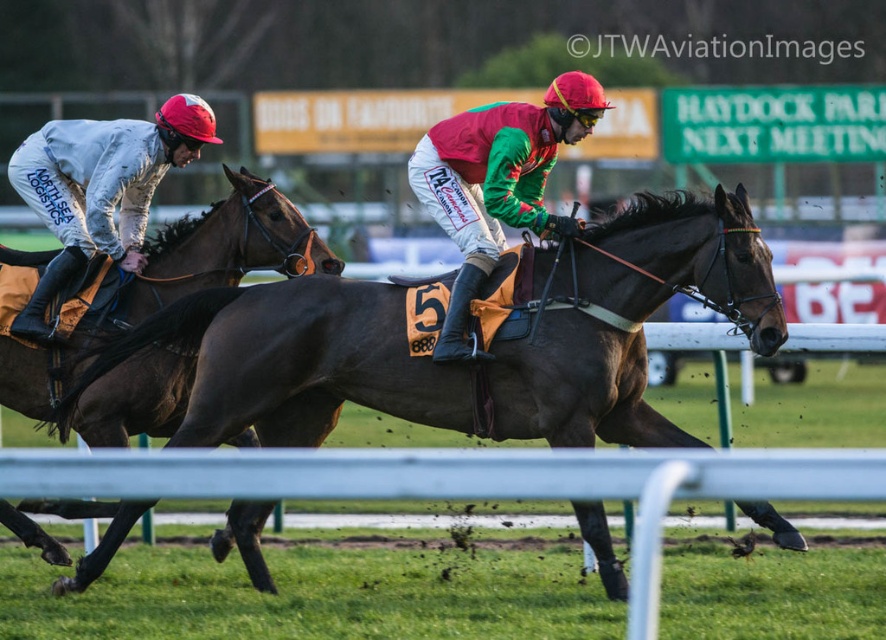
Does shiny brown horse at center have a lesser width compared to brown glossy horse at left?

No, shiny brown horse at center is not thinner than brown glossy horse at left.

Is shiny brown horse at center below brown glossy horse at left?

Indeed, shiny brown horse at center is positioned under brown glossy horse at left.

Which is behind, point (346, 396) or point (141, 305)?

The point (141, 305) is more distant.

The height and width of the screenshot is (640, 886). I want to click on shiny brown horse at center, so click(293, 362).

Is shiny brown horse at center smaller than matte white jockey suit at left?

No.

Which is behind, point (266, 397) or point (65, 134)?

Point (65, 134)

Is point (119, 339) positioned behind point (162, 161)?

That is False.

The height and width of the screenshot is (640, 886). What are the coordinates of `shiny brown horse at center` in the screenshot? It's located at (293, 362).

Between brown glossy horse at left and green and red jersey at center, which one has less height?

Standing shorter between the two is brown glossy horse at left.

The height and width of the screenshot is (640, 886). Identify the location of brown glossy horse at left. (228, 244).